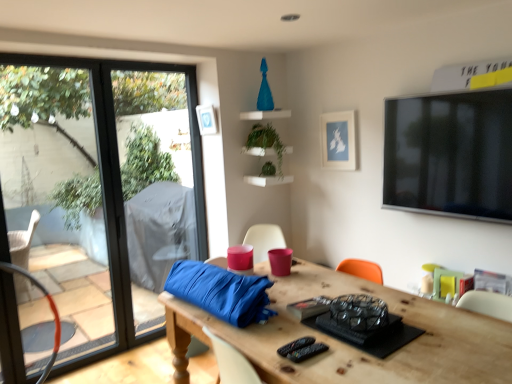
Question: Is transparent glass window at left with green matte plant at center, the 1th plant from the top?

Choices:
 (A) yes
 (B) no

Answer: (B)

Question: From the image's perspective, does transparent glass window at left appear lower than green matte plant at center, the 1th plant from the top?

Choices:
 (A) no
 (B) yes

Answer: (B)

Question: From a real-world perspective, is transparent glass window at left on green matte plant at center, which is counted as the second plant, starting from the bottom?

Choices:
 (A) yes
 (B) no

Answer: (B)

Question: Considering the relative positions of transparent glass window at left and green matte plant at center, which is counted as the second plant, starting from the bottom, in the image provided, is transparent glass window at left in front of green matte plant at center, which is counted as the second plant, starting from the bottom,?

Choices:
 (A) yes
 (B) no

Answer: (A)

Question: Can you confirm if transparent glass window at left is shorter than green matte plant at center, which is counted as the second plant, starting from the bottom?

Choices:
 (A) yes
 (B) no

Answer: (B)

Question: From the image's perspective, is transparent glass window at left located above or below green matte plant at center, the 1th plant from the top?

Choices:
 (A) below
 (B) above

Answer: (A)

Question: Does point (9, 322) appear closer or farther from the camera than point (266, 125)?

Choices:
 (A) farther
 (B) closer

Answer: (B)

Question: In the image, is transparent glass window at left on the left side or the right side of green matte plant at center, the 1th plant from the top?

Choices:
 (A) right
 (B) left

Answer: (B)

Question: Considering the positions of transparent glass window at left and green matte plant at center, which is counted as the second plant, starting from the bottom, in the image, is transparent glass window at left bigger or smaller than green matte plant at center, which is counted as the second plant, starting from the bottom,?

Choices:
 (A) big
 (B) small

Answer: (A)

Question: Considering their positions, is matte blue picture frame at upper center, which is the 1th picture frame from right to left, located in front of or behind green matte plant at center, the 1th plant from the top?

Choices:
 (A) front
 (B) behind

Answer: (A)

Question: Considering the positions of matte blue picture frame at upper center, the 2th picture frame viewed from the left, and green matte plant at center, the 1th plant from the top, in the image, is matte blue picture frame at upper center, the 2th picture frame viewed from the left, wider or thinner than green matte plant at center, the 1th plant from the top,?

Choices:
 (A) thin
 (B) wide

Answer: (A)

Question: In the image, is matte blue picture frame at upper center, the 2th picture frame viewed from the left, on the left side or the right side of green matte plant at center, which is counted as the second plant, starting from the bottom?

Choices:
 (A) left
 (B) right

Answer: (B)

Question: Considering the positions of matte blue picture frame at upper center, which is the 1th picture frame from right to left, and green matte plant at center, the 1th plant from the top, in the image, is matte blue picture frame at upper center, which is the 1th picture frame from right to left, bigger or smaller than green matte plant at center, the 1th plant from the top,?

Choices:
 (A) small
 (B) big

Answer: (A)

Question: Looking at their shapes, would you say metallic orange swivel chair at left is wider or thinner than matte blue picture frame at upper center, which is the 1th picture frame from right to left?

Choices:
 (A) thin
 (B) wide

Answer: (B)

Question: From a real-world perspective, is metallic orange swivel chair at left physically located above or below matte blue picture frame at upper center, which is the 1th picture frame from right to left?

Choices:
 (A) above
 (B) below

Answer: (B)